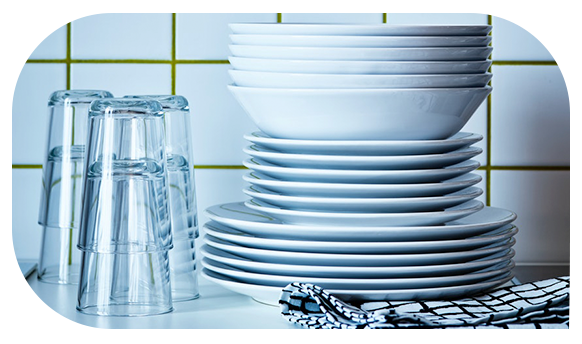
You are a GUI agent. You are given a task and a screenshot of the screen. Output one action in this format:
    pyautogui.click(x=<x>, y=<y>)
    Task: Click on the bowls
    The width and height of the screenshot is (582, 344).
    Given the screenshot: What is the action you would take?
    pyautogui.click(x=308, y=99), pyautogui.click(x=285, y=81), pyautogui.click(x=269, y=64), pyautogui.click(x=250, y=50), pyautogui.click(x=246, y=39), pyautogui.click(x=265, y=30)